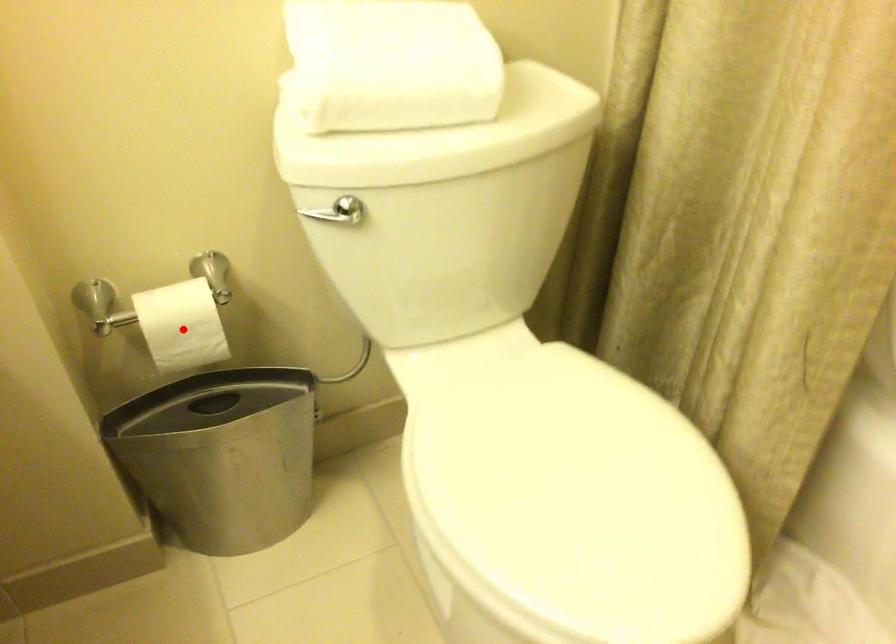
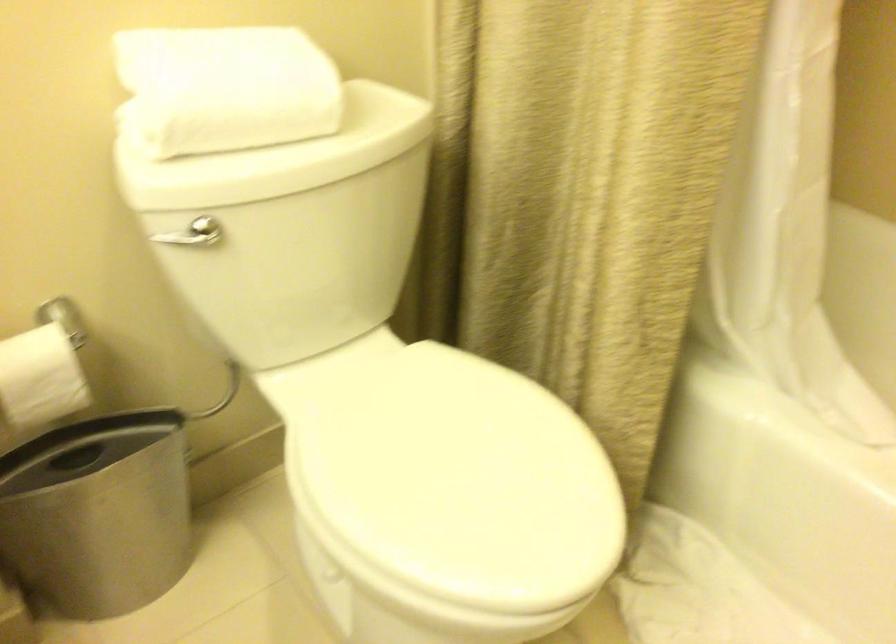
Locate, in the second image, the point that corresponds to the highlighted location in the first image.

(39, 377)